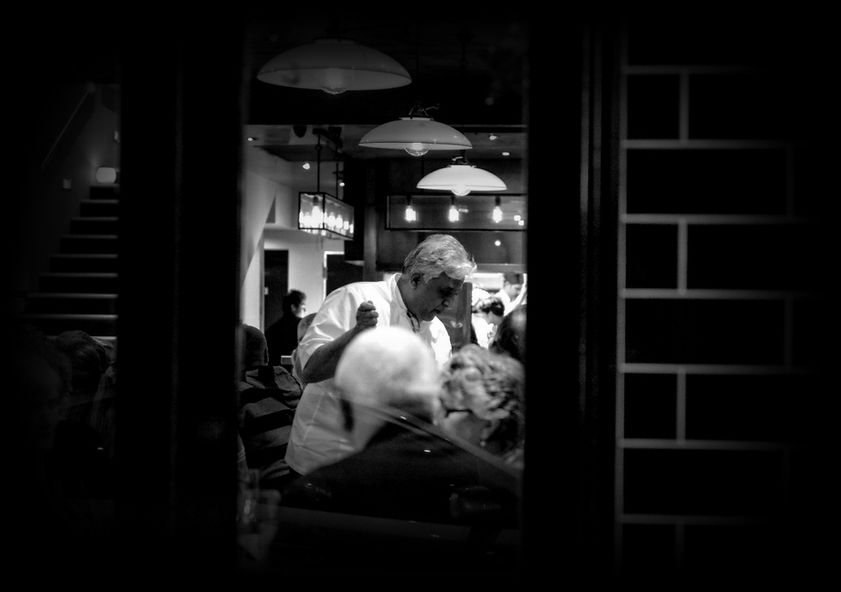
In order to click on doorway in this screenshot , I will do `click(271, 283)`.